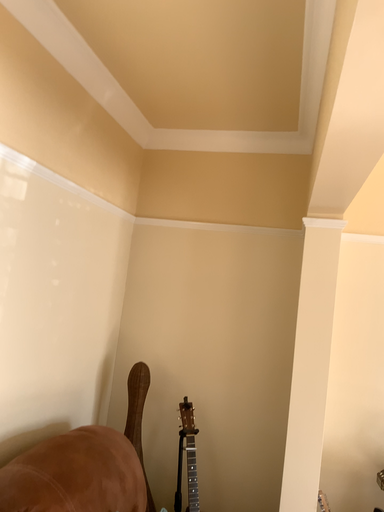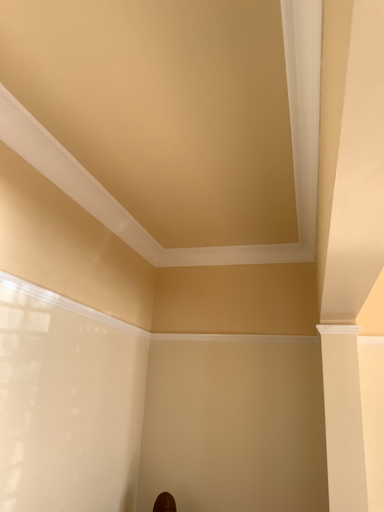
Question: How did the camera likely rotate when shooting the video?

Choices:
 (A) rotated upward
 (B) rotated downward

Answer: (A)